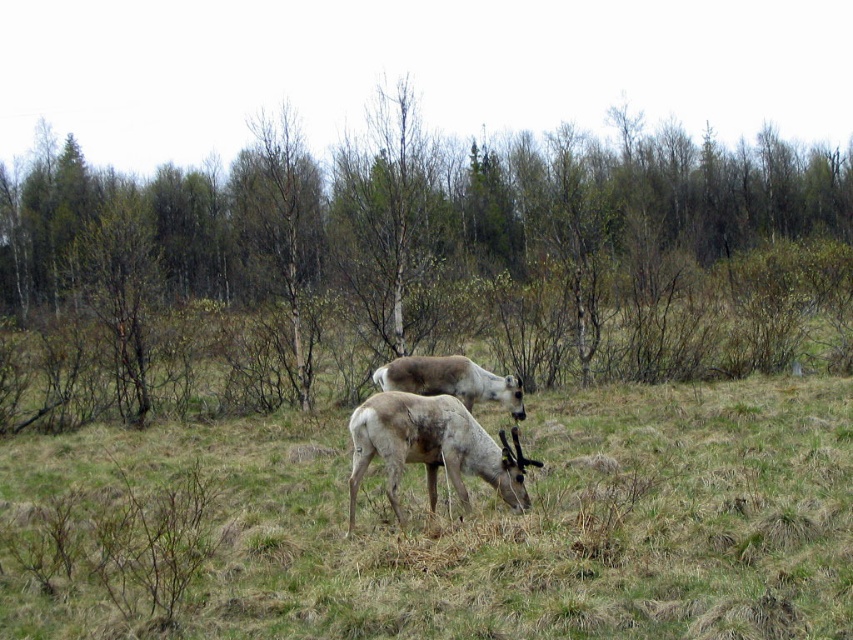
You are standing in the field and want to walk from the brown wood tree at center to the light brown fur at center. Which direction should you move relative to the tree?

You should move to the right relative to the brown wood tree at center because the light brown fur at center is located to the right of the brown wood tree at center.